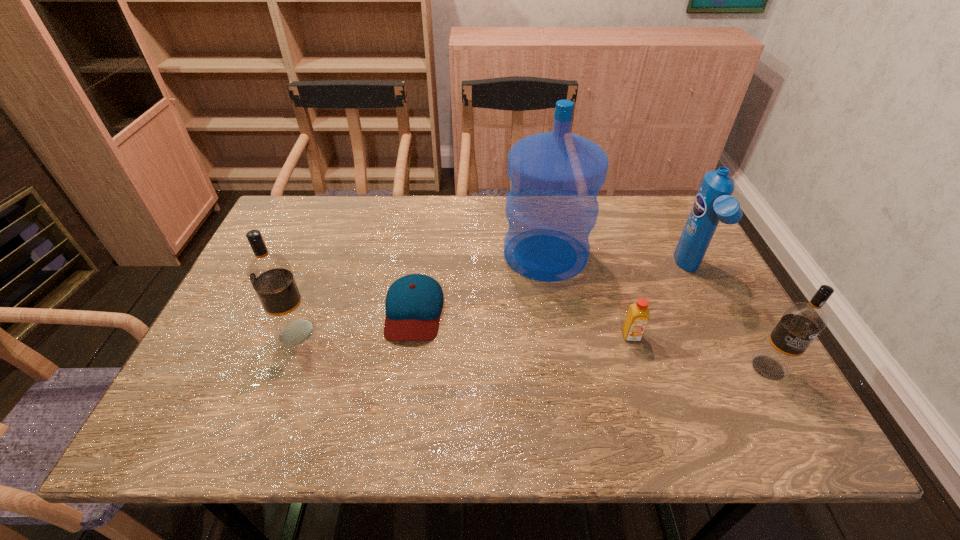
Locate an element on the screen. the left vodka is located at coordinates (270, 274).

The image size is (960, 540). In order to click on the taller vodka in this screenshot , I will do `click(270, 274)`.

I want to click on the third shortest object, so click(802, 322).

Locate an element on the screen. The image size is (960, 540). the nearest object is located at coordinates (802, 322).

At what (x,y) coordinates should I click in order to perform the action: click on the third object from left to right. Please return your answer as a coordinate pair (x, y). Looking at the image, I should click on (551, 208).

Locate an element on the screen. water jug is located at coordinates (551, 208).

You are a GUI agent. You are given a task and a screenshot of the screen. Output one action in this format:
    pyautogui.click(x=<x>, y=<y>)
    Task: Click on the orange juice
    The image size is (960, 540).
    Given the screenshot: What is the action you would take?
    pyautogui.click(x=637, y=317)

The height and width of the screenshot is (540, 960). I want to click on the fifth tallest object, so click(x=637, y=317).

You are a GUI agent. You are given a task and a screenshot of the screen. Output one action in this format:
    pyautogui.click(x=<x>, y=<y>)
    Task: Click on the shampoo
    This screenshot has width=960, height=540.
    Given the screenshot: What is the action you would take?
    pyautogui.click(x=713, y=203)

I want to click on the second object from left to right, so click(414, 302).